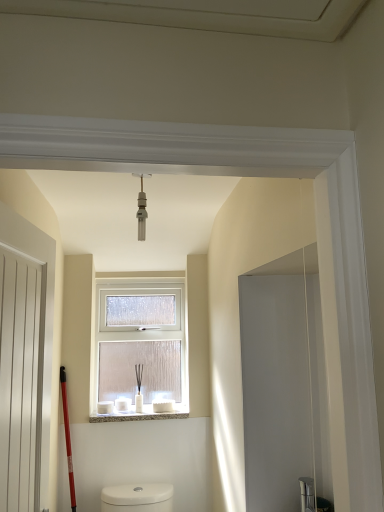
Question: Can you confirm if white wooden screen door at left is bigger than matte silver light fixture at center?

Choices:
 (A) yes
 (B) no

Answer: (A)

Question: Considering the relative positions of white wooden screen door at left and matte silver light fixture at center in the image provided, is white wooden screen door at left behind matte silver light fixture at center?

Choices:
 (A) no
 (B) yes

Answer: (A)

Question: Considering the relative sizes of white wooden screen door at left and matte silver light fixture at center in the image provided, is white wooden screen door at left smaller than matte silver light fixture at center?

Choices:
 (A) no
 (B) yes

Answer: (A)

Question: From the image's perspective, would you say white wooden screen door at left is shown under matte silver light fixture at center?

Choices:
 (A) no
 (B) yes

Answer: (B)

Question: Could matte silver light fixture at center be considered to be inside white wooden screen door at left?

Choices:
 (A) yes
 (B) no

Answer: (B)

Question: Is clear frosted glass window at center spatially inside white textured stone at center, or outside of it?

Choices:
 (A) outside
 (B) inside

Answer: (A)

Question: In the image, is clear frosted glass window at center on the left side or the right side of white textured stone at center?

Choices:
 (A) left
 (B) right

Answer: (A)

Question: Considering the positions of clear frosted glass window at center and white textured stone at center in the image, is clear frosted glass window at center wider or thinner than white textured stone at center?

Choices:
 (A) wide
 (B) thin

Answer: (B)

Question: From a real-world perspective, is clear frosted glass window at center physically located above or below white textured stone at center?

Choices:
 (A) above
 (B) below

Answer: (A)

Question: Does point (130, 418) appear closer or farther from the camera than point (102, 322)?

Choices:
 (A) closer
 (B) farther

Answer: (A)

Question: Considering the relative positions of white textured stone at center and clear frosted glass window at center in the image provided, is white textured stone at center to the left or to the right of clear frosted glass window at center?

Choices:
 (A) right
 (B) left

Answer: (A)

Question: From a real-world perspective, is white textured stone at center above or below clear frosted glass window at center?

Choices:
 (A) above
 (B) below

Answer: (B)

Question: From the image's perspective, is white textured stone at center positioned above or below clear frosted glass window at center?

Choices:
 (A) above
 (B) below

Answer: (B)

Question: Does point (104, 412) appear closer or farther from the camera than point (11, 382)?

Choices:
 (A) closer
 (B) farther

Answer: (B)

Question: From the image's perspective, is clear frosted glass window at center located above or below white wooden screen door at left?

Choices:
 (A) above
 (B) below

Answer: (B)